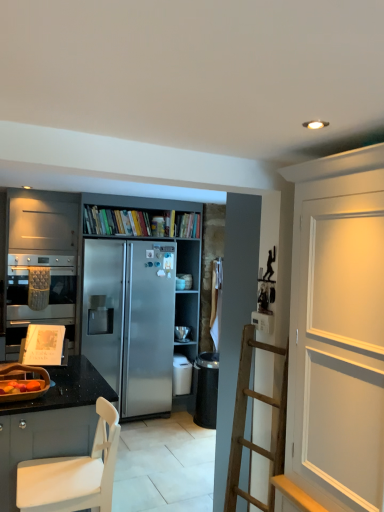
Question: Which direction should I rotate to face satin silver refrigerator at center, which appears as the 3th appliance when viewed from the left, — up or down?

Choices:
 (A) up
 (B) down

Answer: (B)

Question: Is satin silver refrigerator at center, the second cabinetry positioned from the front, next to black granite countertop at lower left, the first cabinetry from the front?

Choices:
 (A) no
 (B) yes

Answer: (A)

Question: From the image's perspective, does satin silver refrigerator at center, the second cabinetry positioned from the front, appear higher than black granite countertop at lower left, arranged as the 2th cabinetry when viewed from the back?

Choices:
 (A) no
 (B) yes

Answer: (B)

Question: From a real-world perspective, is satin silver refrigerator at center, the second cabinetry positioned from the front, beneath black granite countertop at lower left, arranged as the 2th cabinetry when viewed from the back?

Choices:
 (A) no
 (B) yes

Answer: (A)

Question: Is satin silver refrigerator at center, the second cabinetry positioned from the front, smaller than black granite countertop at lower left, the first cabinetry from the front?

Choices:
 (A) yes
 (B) no

Answer: (B)

Question: Can you confirm if satin silver refrigerator at center, the second cabinetry positioned from the front, is shorter than black granite countertop at lower left, arranged as the 2th cabinetry when viewed from the back?

Choices:
 (A) yes
 (B) no

Answer: (B)

Question: Would you say satin silver refrigerator at center, the second cabinetry positioned from the front, is a long distance from black granite countertop at lower left, arranged as the 2th cabinetry when viewed from the back?

Choices:
 (A) yes
 (B) no

Answer: (A)

Question: Does matte silver oven at left have a greater width compared to white painted wood door at upper right?

Choices:
 (A) no
 (B) yes

Answer: (B)

Question: Can you confirm if matte silver oven at left is thinner than white painted wood door at upper right?

Choices:
 (A) yes
 (B) no

Answer: (B)

Question: Does matte silver oven at left have a greater height compared to white painted wood door at upper right?

Choices:
 (A) no
 (B) yes

Answer: (A)

Question: From a real-world perspective, is matte silver oven at left located beneath white painted wood door at upper right?

Choices:
 (A) no
 (B) yes

Answer: (B)

Question: Is matte silver oven at left positioned with its back to white painted wood door at upper right?

Choices:
 (A) no
 (B) yes

Answer: (A)

Question: Is matte silver oven at left not within white painted wood door at upper right?

Choices:
 (A) no
 (B) yes

Answer: (B)

Question: Does matte silver oven at left have a lesser width compared to black granite countertop at lower left, the first cabinetry from the front?

Choices:
 (A) no
 (B) yes

Answer: (B)